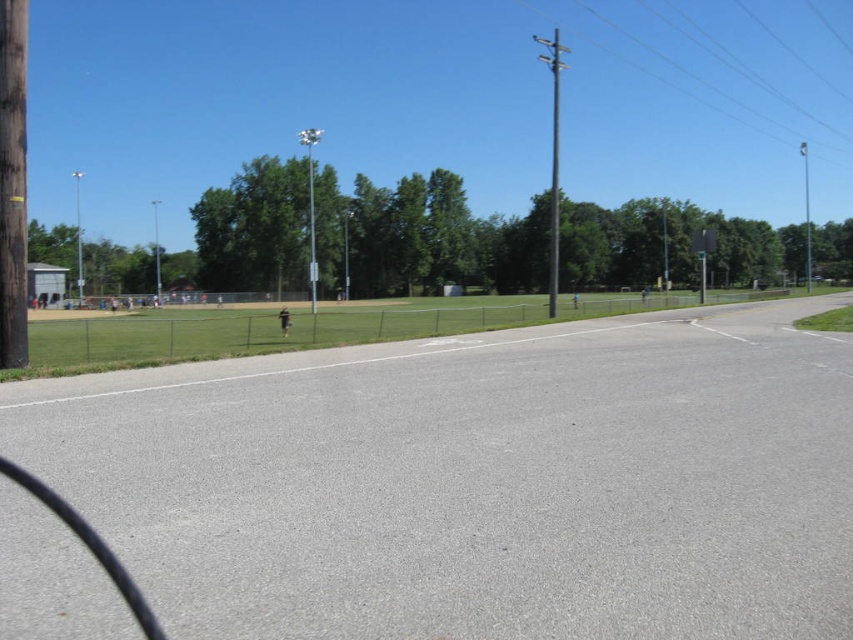
You are standing at the point marked as point [311,211] in the image. What object is located exactly at your current position?

The silver metallic pole at center is located exactly at point [311,211].

You are standing at the center of the baseball field and want to locate the gray metallic pole at left. According to the coordinates provided, in which direction should you look relative to your position?

The gray metallic pole at left is located at coordinates point (78, 236), which places it to the left side of the scene. Therefore, you should look to your left to find the gray metallic pole at left.